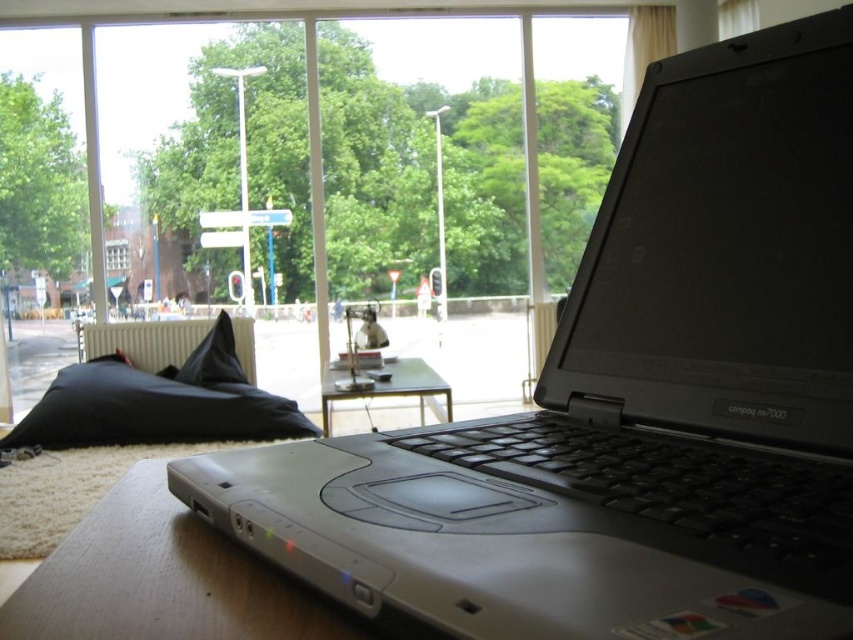
You are a delivery robot with a height of 1.5 meters. You need to move from the clear glass table at center to the clear glass window at center. Can you pass through the space between them without bending down?

The distance between the clear glass table at center and the clear glass window at center is 1.87 meters, which is wider than the robot height of 1.5 meters. Therefore, the robot can pass through the space between them without bending down.

Please provide the 2D coordinates of the clear glass table at center in the image. Your answer should be in the format of coordinates in parentheses, like this example format. Please do not add any extra text or explanations.

The 2D coordinates of the clear glass table at center are at point (387, 387).